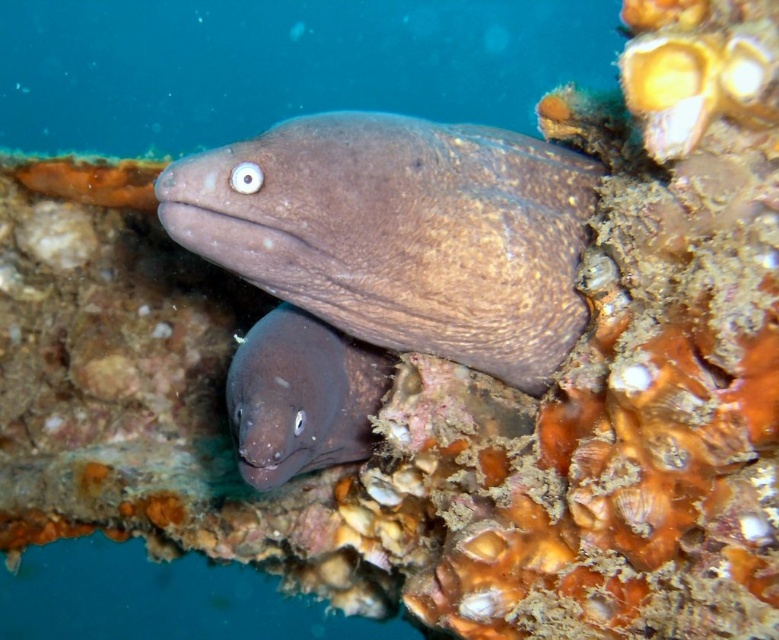
Question: Which point is farther from the camera taking this photo?

Choices:
 (A) (270, 356)
 (B) (527, 170)

Answer: (B)

Question: Where is brown matte moray at center located in relation to smooth brown eel at center in the image?

Choices:
 (A) right
 (B) left

Answer: (A)

Question: Which of the following is the closest to the observer?

Choices:
 (A) brown matte moray at center
 (B) smooth brown eel at center

Answer: (A)

Question: Observing the image, what is the correct spatial positioning of brown matte moray at center in reference to smooth brown eel at center?

Choices:
 (A) above
 (B) below

Answer: (A)

Question: Can you confirm if brown matte moray at center is smaller than smooth brown eel at center?

Choices:
 (A) yes
 (B) no

Answer: (B)